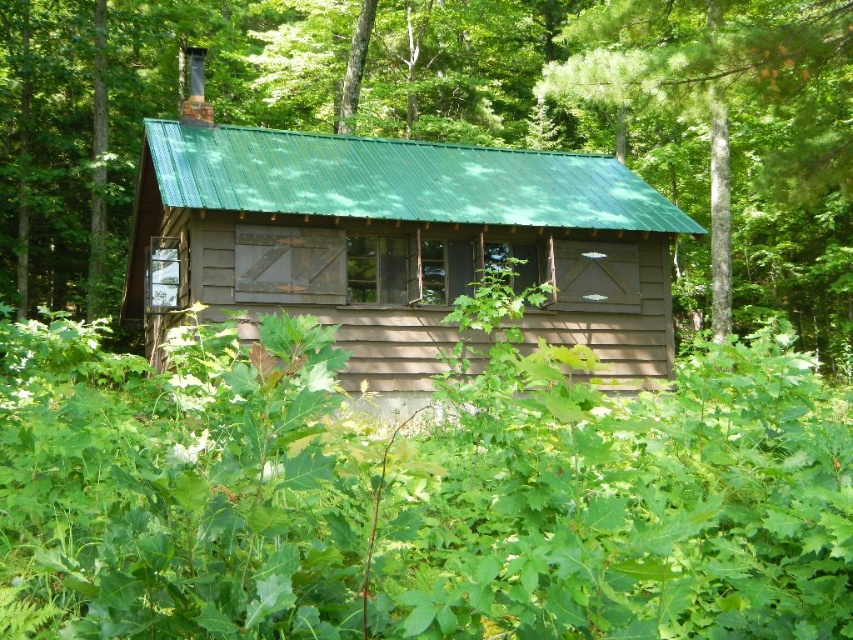
This screenshot has height=640, width=853. I want to click on green leafy foliage at center, so click(421, 492).

Is green leafy foliage at center behind brown wooden cabin at center?

No, green leafy foliage at center is in front of brown wooden cabin at center.

Is point (126, 416) behind point (270, 160)?

No, it is not.

The width and height of the screenshot is (853, 640). I want to click on green leafy foliage at center, so click(421, 492).

Can you confirm if green leafy foliage at center is positioned above green leafy tree at center?

Actually, green leafy foliage at center is below green leafy tree at center.

Is point (477, 474) behind point (62, 202)?

No, it is not.

Find the location of `green leafy foliage at center`. green leafy foliage at center is located at coordinates (421, 492).

Is green leafy tree at center smaller than brown wooden cabin at center?

No.

Which is more to the right, green leafy tree at center or brown wooden cabin at center?

brown wooden cabin at center is more to the right.

Is point (312, 122) less distant than point (403, 252)?

No, (312, 122) is further to viewer.

Find the location of a particular element. green leafy tree at center is located at coordinates (135, 113).